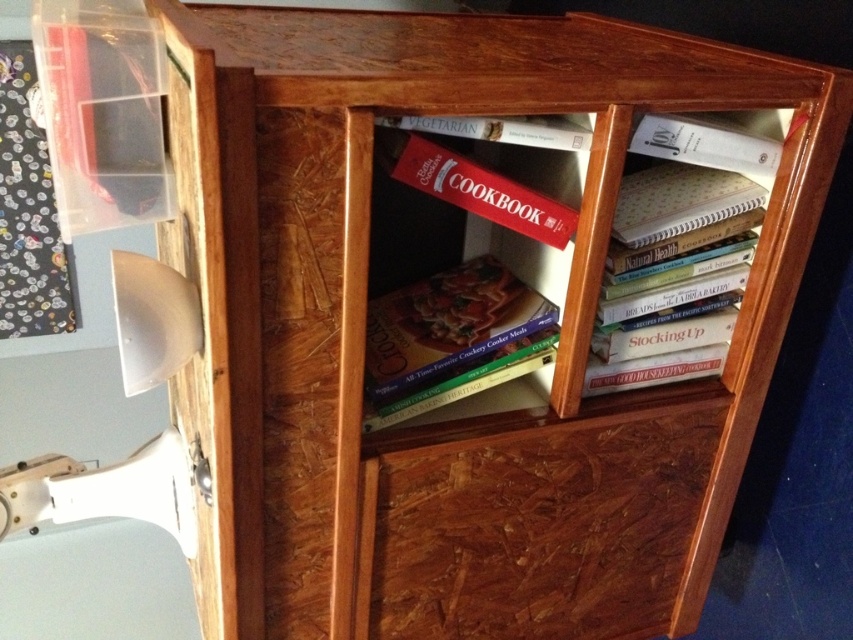
Does wooden drawer at center have a larger size compared to white paper notebook at right?

Indeed, wooden drawer at center has a larger size compared to white paper notebook at right.

Who is lower down, wooden drawer at center or white paper notebook at right?

wooden drawer at center is below.

Does point (672, 456) come behind point (653, 152)?

Yes.

This screenshot has width=853, height=640. Identify the location of wooden drawer at center. (543, 522).

Is matte hardcover cookbook at center below matte red cookbook at center?

Indeed, matte hardcover cookbook at center is positioned under matte red cookbook at center.

The width and height of the screenshot is (853, 640). What do you see at coordinates (451, 339) in the screenshot?
I see `matte hardcover cookbook at center` at bounding box center [451, 339].

I want to click on matte hardcover cookbook at center, so [451, 339].

Does matte red cookbook at center appear under white paper at upper right?

Correct, matte red cookbook at center is located below white paper at upper right.

Based on the photo, does matte red cookbook at center have a greater width compared to white paper at upper right?

Yes, matte red cookbook at center is wider than white paper at upper right.

Does point (531, 193) come closer to viewer compared to point (758, 157)?

Yes.

What are the coordinates of `matte red cookbook at center` in the screenshot? It's located at (473, 186).